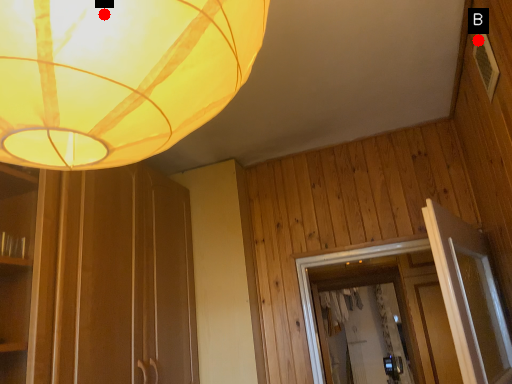
Question: Two points are circled on the image, labeled by A and B beside each circle. Which point is closer to the camera taking this photo?

Choices:
 (A) A is closer
 (B) B is closer

Answer: (A)